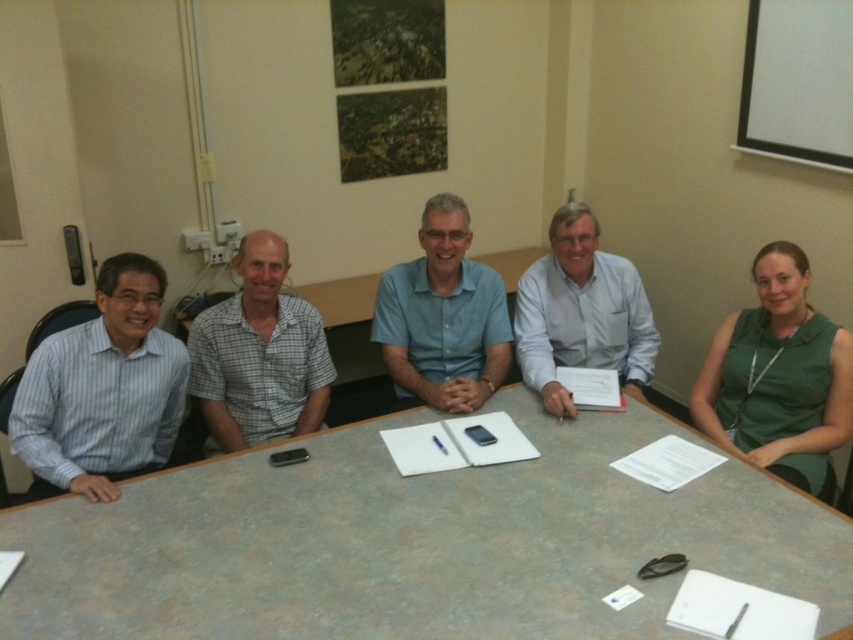
Is the position of smooth gray table at center less distant than that of green sleeveless top at right?

That is True.

Between point (151, 490) and point (758, 321), which one is positioned in front?

Point (151, 490) is in front.

Is point (332, 483) farther from viewer compared to point (834, 433)?

No.

Find the location of `smooth gray table at center`. smooth gray table at center is located at coordinates (416, 541).

Who is more distant from viewer, [636,586] or [628,278]?

Point [628,278]

What do you see at coordinates (416, 541) in the screenshot? Image resolution: width=853 pixels, height=640 pixels. I see `smooth gray table at center` at bounding box center [416, 541].

Is point (367, 621) positioned in front of point (521, 349)?

Yes.

You are a GUI agent. You are given a task and a screenshot of the screen. Output one action in this format:
    pyautogui.click(x=<x>, y=<y>)
    Task: Click on the smooth gray table at center
    
    Given the screenshot: What is the action you would take?
    pyautogui.click(x=416, y=541)

Consider the image. Who is higher up, smooth gray table at center or blue cotton shirt at center?

blue cotton shirt at center

Is smooth gray table at center to the right of blue cotton shirt at center from the viewer's perspective?

No, smooth gray table at center is not to the right of blue cotton shirt at center.

Which is behind, point (299, 529) or point (439, 353)?

Point (439, 353)

The width and height of the screenshot is (853, 640). Identify the location of smooth gray table at center. (416, 541).